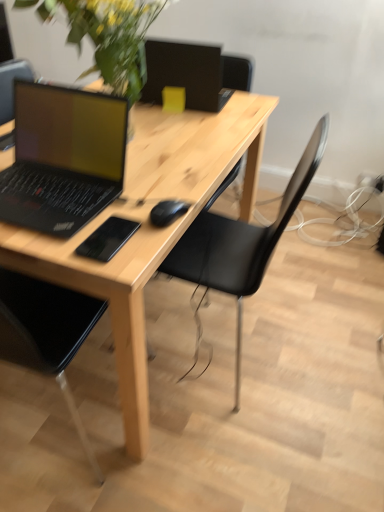
Locate an element on the screen. vacant space to the left of black matte mouse at center is located at coordinates (110, 212).